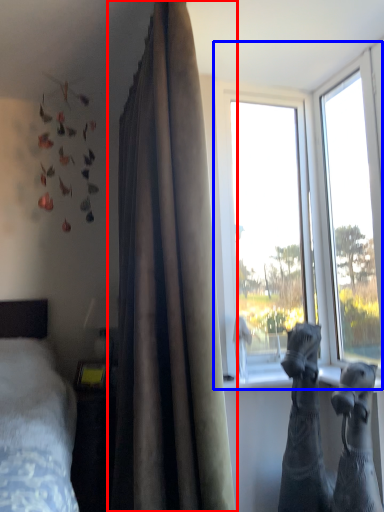
Question: Which object is closer to the camera taking this photo, curtain (highlighted by a red box) or window (highlighted by a blue box)?

Choices:
 (A) curtain
 (B) window

Answer: (A)